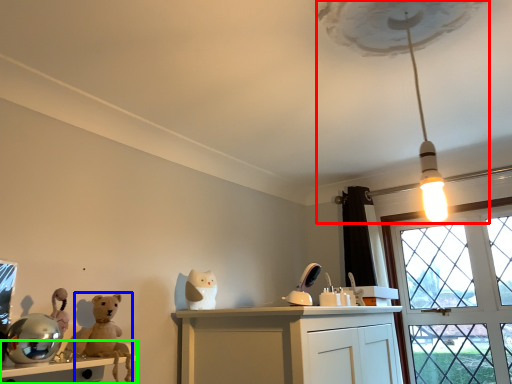
Question: Which object is the closest to the lamp (highlighted by a red box)? Choose among these: animal (highlighted by a blue box) or table (highlighted by a green box).

Choices:
 (A) animal
 (B) table

Answer: (A)